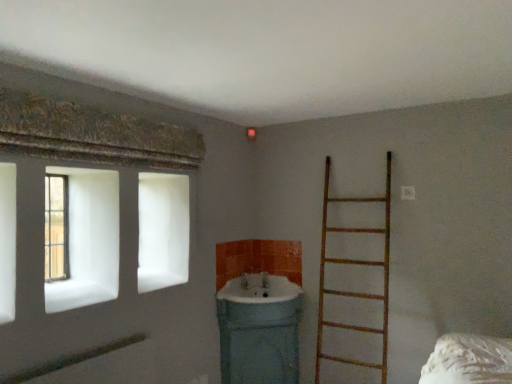
What do you see at coordinates (355, 264) in the screenshot? This screenshot has height=384, width=512. I see `wooden ladder at right` at bounding box center [355, 264].

Describe the element at coordinates (259, 289) in the screenshot. The width and height of the screenshot is (512, 384). I see `white glossy sink at center, the 1th sink viewed from the top` at that location.

Identify the location of wooden frame window at left. The width and height of the screenshot is (512, 384). (56, 228).

In terms of width, does white glossy sink at center, the 1th sink viewed from the top, look wider or thinner when compared to matte white sink at center, arranged as the first sink when ordered from the bottom?

white glossy sink at center, the 1th sink viewed from the top, is wider than matte white sink at center, arranged as the first sink when ordered from the bottom.

From the image's perspective, is white glossy sink at center, the 1th sink viewed from the top, above matte white sink at center, arranged as the first sink when ordered from the bottom?

Yes, from the image's perspective, white glossy sink at center, the 1th sink viewed from the top, is on top of matte white sink at center, arranged as the first sink when ordered from the bottom.

Is point (291, 292) behind point (273, 352)?

No, it is in front of (273, 352).

Relative to matte white sink at center, arranged as the first sink when ordered from the bottom, is wooden frame window at left in front or behind?

In the image, wooden frame window at left appears in front of matte white sink at center, arranged as the first sink when ordered from the bottom.

How many degrees apart are the facing directions of wooden frame window at left and matte white sink at center, the 2th sink from the top?

The facing directions of wooden frame window at left and matte white sink at center, the 2th sink from the top, are 86.3 degrees apart.

Does point (56, 228) come farther from viewer compared to point (273, 336)?

Yes, it is.

From a real-world perspective, is wooden frame window at left beneath matte white sink at center, the 2th sink from the top?

No, from a real-world perspective, wooden frame window at left is not below matte white sink at center, the 2th sink from the top.

Can you tell me how much white glossy sink at center, the 1th sink viewed from the top, and wooden frame window at left differ in facing direction?

86.3 degrees.

Which object is closer to the camera, white glossy sink at center, the 1th sink viewed from the top, or wooden frame window at left?

wooden frame window at left is in front.

From a real-world perspective, is white glossy sink at center, the 1th sink viewed from the top, below wooden frame window at left?

Indeed, from a real-world perspective, white glossy sink at center, the 1th sink viewed from the top, is positioned beneath wooden frame window at left.

Do you think wooden ladder at right is within white glossy sink at center, the 1th sink viewed from the top, or outside of it?

wooden ladder at right is outside white glossy sink at center, the 1th sink viewed from the top.

From the image's perspective, is wooden ladder at right on white glossy sink at center, the 1th sink viewed from the top?

Yes, from the image's perspective, wooden ladder at right is on top of white glossy sink at center, the 1th sink viewed from the top.

Is wooden ladder at right turned away from white glossy sink at center, the 1th sink viewed from the top?

No, wooden ladder at right is not facing the opposite direction of white glossy sink at center, the 1th sink viewed from the top.

From a real-world perspective, is wooden ladder at right positioned over white glossy sink at center, the 1th sink viewed from the top, based on gravity?

Yes, from a real-world perspective, wooden ladder at right is above white glossy sink at center, the 1th sink viewed from the top.

From a real-world perspective, is white glossy sink at center, placed as the 2th sink when sorted from bottom to top, positioned above or below wooden ladder at right?

white glossy sink at center, placed as the 2th sink when sorted from bottom to top, is below wooden ladder at right.

Is white glossy sink at center, the 1th sink viewed from the top, oriented away from wooden ladder at right?

white glossy sink at center, the 1th sink viewed from the top, does not have its back to wooden ladder at right.

Considering the relative sizes of white glossy sink at center, placed as the 2th sink when sorted from bottom to top, and wooden ladder at right in the image provided, is white glossy sink at center, placed as the 2th sink when sorted from bottom to top, smaller than wooden ladder at right?

Correct, white glossy sink at center, placed as the 2th sink when sorted from bottom to top, occupies less space than wooden ladder at right.

In the scene shown: Considering the relative sizes of wooden ladder at right and matte white sink at center, the 2th sink from the top, in the image provided, is wooden ladder at right wider than matte white sink at center, the 2th sink from the top,?

In fact, wooden ladder at right might be narrower than matte white sink at center, the 2th sink from the top.

Is wooden ladder at right facing away from matte white sink at center, the 2th sink from the top?

That's not correct — wooden ladder at right is not looking away from matte white sink at center, the 2th sink from the top.

Which is in front, wooden ladder at right or matte white sink at center, arranged as the first sink when ordered from the bottom?

wooden ladder at right.

Is wooden ladder at right placed right next to matte white sink at center, arranged as the first sink when ordered from the bottom?

No, wooden ladder at right is not beside matte white sink at center, arranged as the first sink when ordered from the bottom.

Considering the sizes of objects matte white sink at center, arranged as the first sink when ordered from the bottom, and white glossy sink at center, placed as the 2th sink when sorted from bottom to top, in the image provided, who is bigger, matte white sink at center, arranged as the first sink when ordered from the bottom, or white glossy sink at center, placed as the 2th sink when sorted from bottom to top,?

matte white sink at center, arranged as the first sink when ordered from the bottom, is bigger.

Is matte white sink at center, arranged as the first sink when ordered from the bottom, with white glossy sink at center, placed as the 2th sink when sorted from bottom to top?

There is a gap between matte white sink at center, arranged as the first sink when ordered from the bottom, and white glossy sink at center, placed as the 2th sink when sorted from bottom to top.

Who is taller, matte white sink at center, arranged as the first sink when ordered from the bottom, or white glossy sink at center, placed as the 2th sink when sorted from bottom to top?

With more height is matte white sink at center, arranged as the first sink when ordered from the bottom.

Is matte white sink at center, arranged as the first sink when ordered from the bottom, closer to the viewer compared to white glossy sink at center, the 1th sink viewed from the top?

Yes, matte white sink at center, arranged as the first sink when ordered from the bottom, is closer to the camera.

Identify the location of sink below the white glossy sink at center, placed as the 2th sink when sorted from bottom to top (from the image's perspective). (259, 331).

Identify the location of window to the left of matte white sink at center, arranged as the first sink when ordered from the bottom. Image resolution: width=512 pixels, height=384 pixels. (56, 228).

From the image, which object appears to be nearer to wooden frame window at left, white glossy sink at center, the 1th sink viewed from the top, or wooden ladder at right?

white glossy sink at center, the 1th sink viewed from the top, is positioned closer to the anchor wooden frame window at left.

From the image, which object appears to be nearer to wooden ladder at right, matte white sink at center, arranged as the first sink when ordered from the bottom, or wooden frame window at left?

matte white sink at center, arranged as the first sink when ordered from the bottom.

When comparing their distances from white glossy sink at center, placed as the 2th sink when sorted from bottom to top, does wooden ladder at right or wooden frame window at left seem further?

Based on the image, wooden frame window at left appears to be further to white glossy sink at center, placed as the 2th sink when sorted from bottom to top.

Based on the photo, which object lies further to the anchor point wooden ladder at right, matte white sink at center, the 2th sink from the top, or white glossy sink at center, the 1th sink viewed from the top?

white glossy sink at center, the 1th sink viewed from the top.

Estimate the real-world distances between objects in this image. Which object is further from white glossy sink at center, the 1th sink viewed from the top, wooden frame window at left or matte white sink at center, arranged as the first sink when ordered from the bottom?

wooden frame window at left is further to white glossy sink at center, the 1th sink viewed from the top.

Which object lies further to the anchor point wooden frame window at left, matte white sink at center, arranged as the first sink when ordered from the bottom, or white glossy sink at center, the 1th sink viewed from the top?

matte white sink at center, arranged as the first sink when ordered from the bottom, is positioned further to the anchor wooden frame window at left.

From the image, which object appears to be farther from matte white sink at center, the 2th sink from the top, wooden frame window at left or white glossy sink at center, the 1th sink viewed from the top?

The object further to matte white sink at center, the 2th sink from the top, is wooden frame window at left.

Which object lies nearer to the anchor point white glossy sink at center, the 1th sink viewed from the top, matte white sink at center, arranged as the first sink when ordered from the bottom, or wooden ladder at right?

Result: Based on the image, matte white sink at center, arranged as the first sink when ordered from the bottom, appears to be nearer to white glossy sink at center, the 1th sink viewed from the top.

The height and width of the screenshot is (384, 512). In order to click on sink between wooden frame window at left and white glossy sink at center, placed as the 2th sink when sorted from bottom to top, in the horizontal direction in this screenshot , I will do [x=259, y=331].

At what (x,y) coordinates should I click in order to perform the action: click on sink between matte white sink at center, the 2th sink from the top, and wooden ladder at right from left to right. Please return your answer as a coordinate pair (x, y). Looking at the image, I should click on (259, 289).